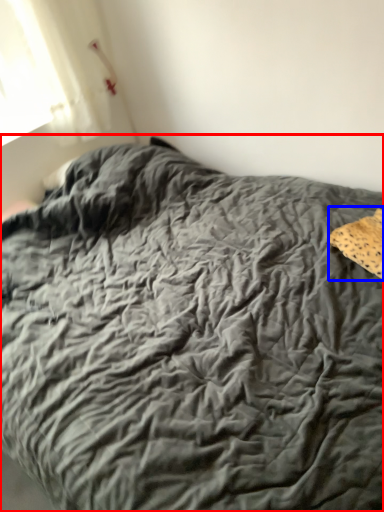
Question: Among these objects, which one is nearest to the camera, bed (highlighted by a red box) or material (highlighted by a blue box)?

Choices:
 (A) bed
 (B) material

Answer: (A)